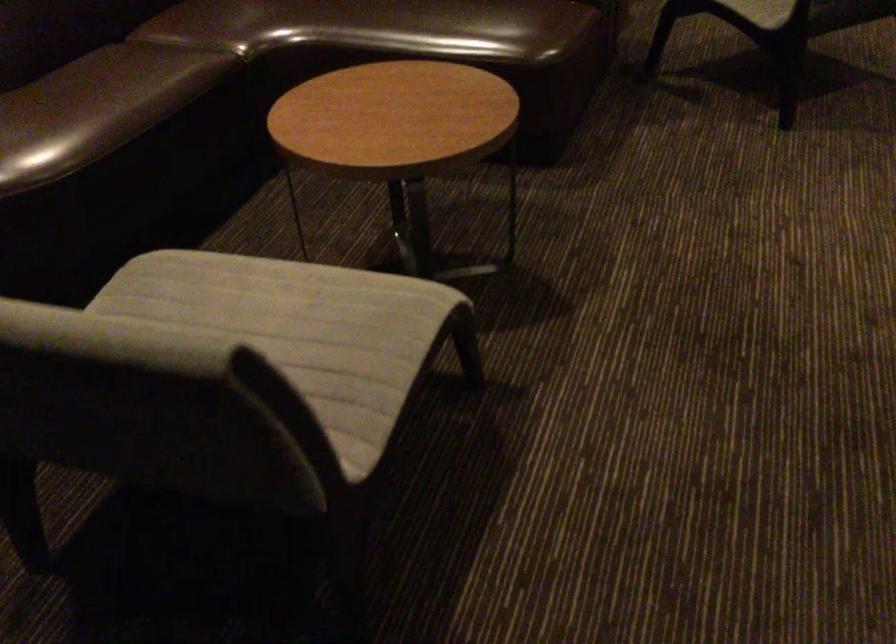
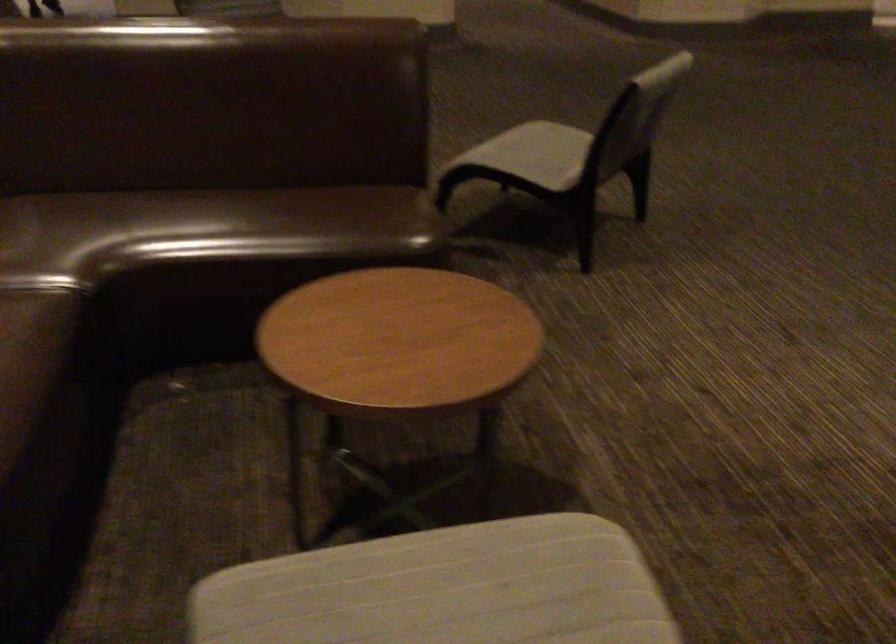
Find the pixel in the second image that matches (x=277, y=299) in the first image.

(444, 589)